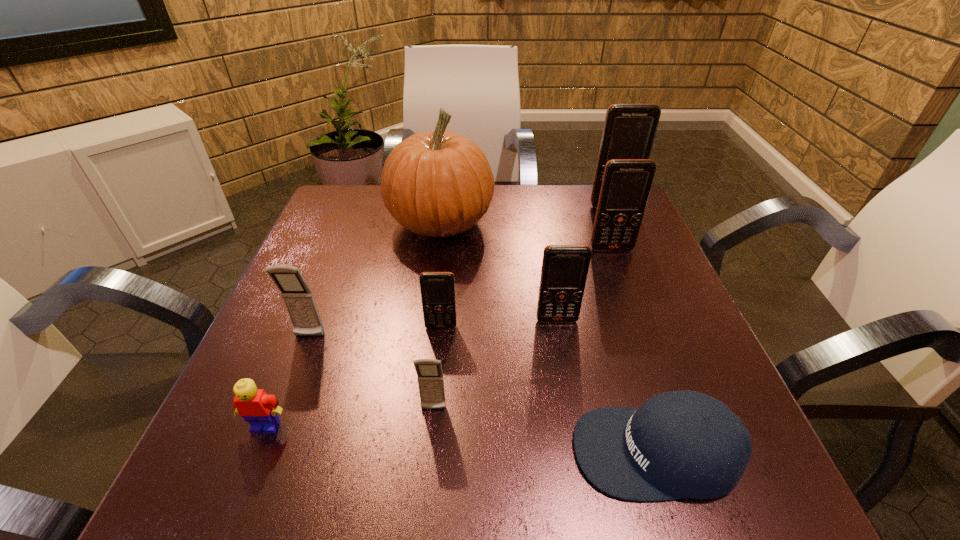
Find the location of `baseball cap present at the right edge`. baseball cap present at the right edge is located at coordinates (678, 444).

At what (x,y) coordinates should I click in order to perform the action: click on object present at the far right corner. Please return your answer as a coordinate pair (x, y). The height and width of the screenshot is (540, 960). Looking at the image, I should click on 629,131.

Find the location of a particular element. The width and height of the screenshot is (960, 540). object at the near right corner is located at coordinates (678, 444).

The image size is (960, 540). I want to click on vacant space at the far edge, so click(483, 234).

The width and height of the screenshot is (960, 540). In the image, there is a desktop. Identify the location of free space at the near edge. (460, 488).

Image resolution: width=960 pixels, height=540 pixels. What are the coordinates of `vacant region at the left edge of the desktop` in the screenshot? It's located at (263, 374).

Where is `blank area at the right edge`? Image resolution: width=960 pixels, height=540 pixels. blank area at the right edge is located at coordinates (638, 253).

The image size is (960, 540). In the image, there is a desktop. Find the location of `free space at the near left corner`. free space at the near left corner is located at coordinates (209, 498).

Where is `vacant area between the leftmost orange cellular telephone and the Lego`? vacant area between the leftmost orange cellular telephone and the Lego is located at coordinates (353, 376).

This screenshot has width=960, height=540. I want to click on free spot between the baseball cap and the left gray cellular telephone, so click(483, 394).